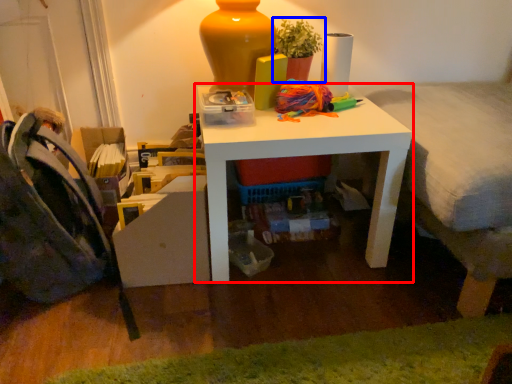
Question: Which object is further to the camera taking this photo, table (highlighted by a red box) or houseplant (highlighted by a blue box)?

Choices:
 (A) table
 (B) houseplant

Answer: (B)